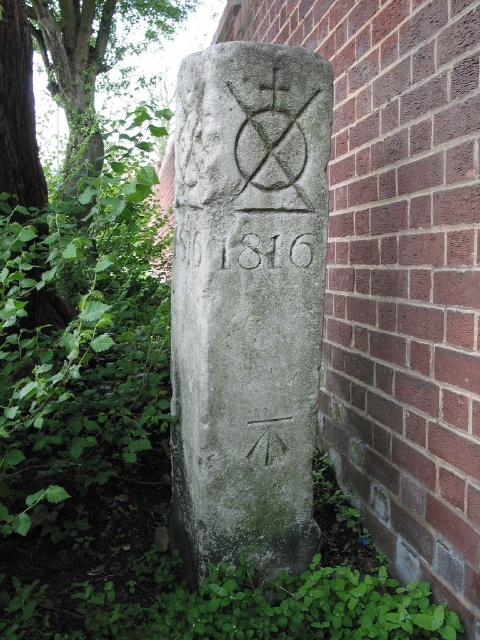
Between gray stone gravestone at center and green leafy weed at left, which one appears on the right side from the viewer's perspective?

gray stone gravestone at center is more to the right.

Is point (189, 256) positioned in front of point (81, 195)?

Yes, it is in front of point (81, 195).

Describe the element at coordinates (247, 304) in the screenshot. The image size is (480, 640). I see `gray stone gravestone at center` at that location.

This screenshot has height=640, width=480. What are the coordinates of `gray stone gravestone at center` in the screenshot? It's located at (247, 304).

Is point (328, 65) in front of point (82, 13)?

Yes, it is in front of point (82, 13).

The image size is (480, 640). In order to click on gray stone gravestone at center in this screenshot , I will do `click(247, 304)`.

Does green leafy tree at left have a larger size compared to gray stone inscription at center?

Indeed, green leafy tree at left has a larger size compared to gray stone inscription at center.

Does green leafy tree at left have a lesser height compared to gray stone inscription at center?

No.

At what (x,y) coordinates should I click in order to perform the action: click on green leafy tree at left. Please return your answer as a coordinate pair (x, y). Looking at the image, I should click on (62, 80).